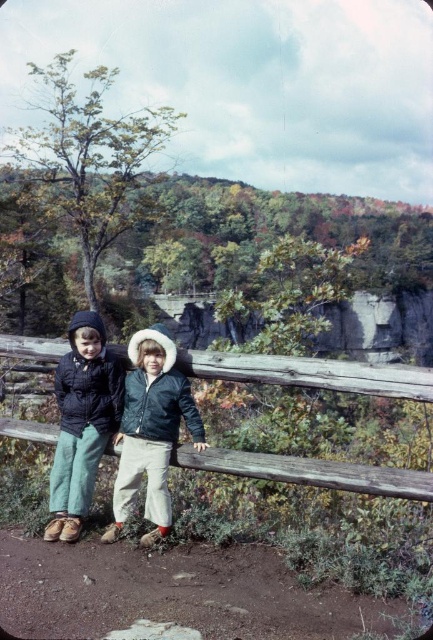
You are a photographer trying to capture a photo of the wooden fence at center and the velvet blue jacket at center. If you want to include both in the frame without cropping, which object should you focus on to ensure both fit?

Since the wooden fence at center is wider than the velvet blue jacket at center, you should focus on the wooden fence at center to ensure both fit in the frame without cropping.

You are a painter who wants to paint the wooden fence at center and the matte black jacket at left. If you have a limited amount of paint, which object should you prioritize painting first based on their sizes?

The wooden fence at center has a larger width than the matte black jacket at left, so you should prioritize painting the wooden fence at center first to ensure you have enough paint.